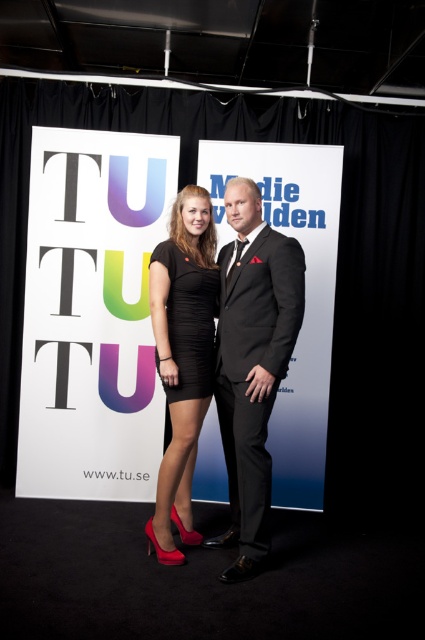
You are attending a formal event and need to choose between the black satin suit at center and the matte black dress at center. Based on their positions in the image, which one is placed higher up?

The matte black dress at center is placed higher up than the black satin suit at center.

You are a fashion designer looking at the image of two people wearing dresses. You notice the matte black dress at center and the black matte dress at center in the scene. Which dress is located below the other?

The matte black dress at center is positioned under the black matte dress at center, meaning it is located below the other one.

You are attending a fashion show and notice two outfits displayed at the center of the stage. The outfits are labeled as the black satin suit at center and the matte black dress at center. Based on their appearance, which outfit is taller?

The black satin suit at center is much taller than the matte black dress at center.